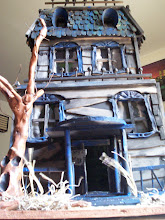
Image resolution: width=165 pixels, height=220 pixels. What are the coordinates of `ceiling` in the screenshot? It's located at click(x=22, y=21).